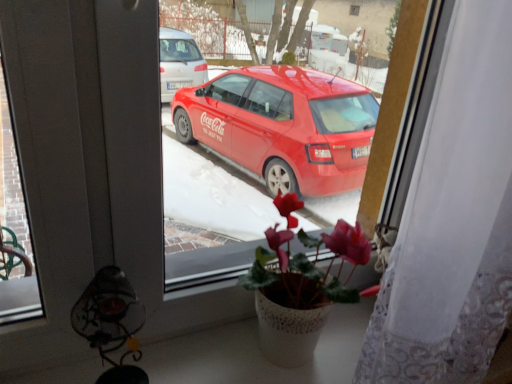
Locate an element on the screen. free space to the left of pink matte cyclamen at center is located at coordinates (216, 350).